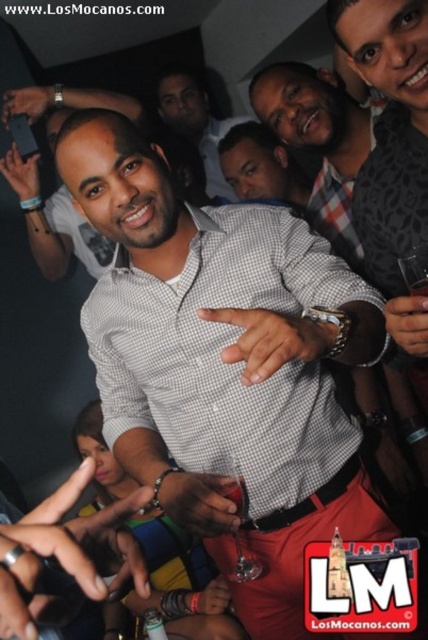
Does point (175, 492) come in front of point (208, 160)?

Yes, point (175, 492) is in front of point (208, 160).

Does white checkered shirt at center appear on the right side of matte gray shirt at center?

Yes, white checkered shirt at center is to the right of matte gray shirt at center.

At what (x,y) coordinates should I click in order to perform the action: click on white checkered shirt at center. Please return your answer as a coordinate pair (x, y). Looking at the image, I should click on click(x=222, y=368).

This screenshot has width=428, height=640. I want to click on white checkered shirt at center, so click(222, 368).

Based on the photo, between white checkered shirt at center and checkered fabric shirt at center, which one has more height?

white checkered shirt at center

Is point (142, 406) in front of point (246, 196)?

Yes, point (142, 406) is in front of point (246, 196).

Find the location of `white checkered shirt at center`. white checkered shirt at center is located at coordinates (222, 368).

Is checkered shirt at center positioned behind checkered fabric shirt at center?

No, checkered shirt at center is in front of checkered fabric shirt at center.

Is checkered shirt at center to the left of checkered fabric shirt at center from the viewer's perspective?

In fact, checkered shirt at center is to the right of checkered fabric shirt at center.

Describe the element at coordinates (320, 140) in the screenshot. I see `checkered shirt at center` at that location.

The width and height of the screenshot is (428, 640). What are the coordinates of `checkered shirt at center` in the screenshot? It's located at (320, 140).